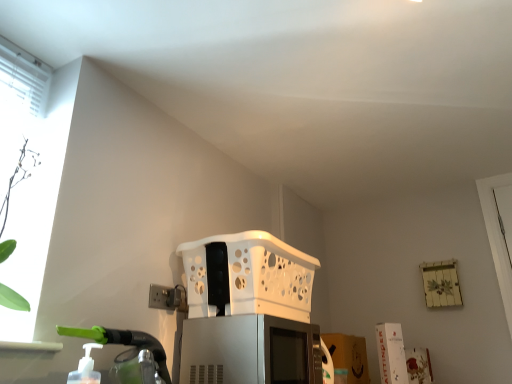
Question: Is point coord(179,291) closer or farther from the camera than point coord(202,350)?

Choices:
 (A) closer
 (B) farther

Answer: (B)

Question: In terms of width, does white plastic electric outlet at lower left look wider or thinner when compared to satin silver microwave at center?

Choices:
 (A) thin
 (B) wide

Answer: (A)

Question: Which object is positioned farthest from the white plastic electric outlet at lower left?

Choices:
 (A) satin silver microwave at center
 (B) white plastic basket at center

Answer: (B)

Question: Estimate the real-world distances between objects in this image. Which object is farther from the satin silver microwave at center?

Choices:
 (A) white plastic electric outlet at lower left
 (B) white plastic basket at center

Answer: (B)